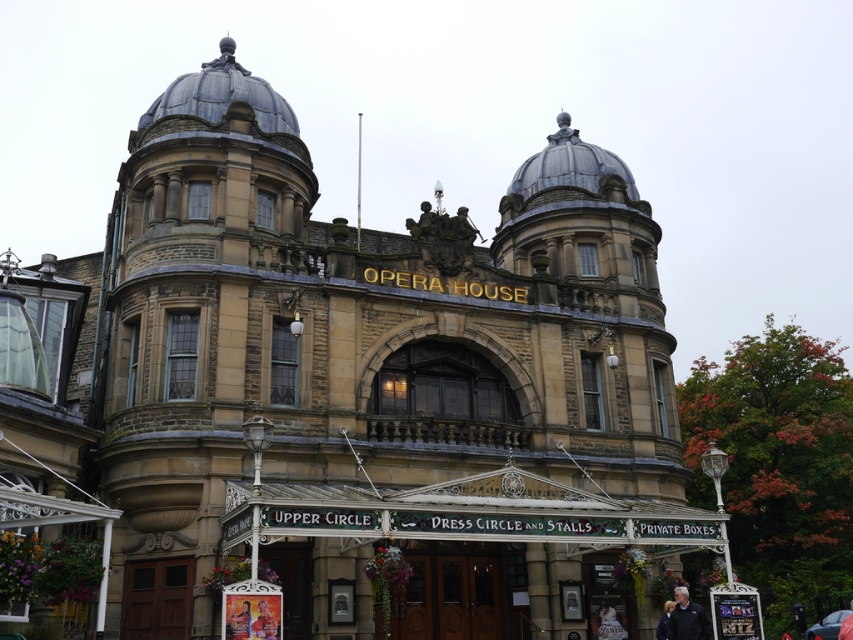
Consider the image. You are attending an event at the Opera House and see the matte red dress at center and the dark blue jacket at lower right. Which item is nearer to you?

The matte red dress at center is closer to the viewer than the dark blue jacket at lower right.

You are attending an event at the Opera House and see a matte yellow dress at center and a white cotton shirt at lower right. Which clothing item is positioned more to the left side of the scene?

The matte yellow dress at center is positioned more to the left side of the scene compared to the white cotton shirt at lower right.

From the picture: You are standing in front of the Opera House entrance and see the point marked at coordinates (x=239, y=621). What color is the dress located at that point?

The dress at point (x=239, y=621) is matte yellow.